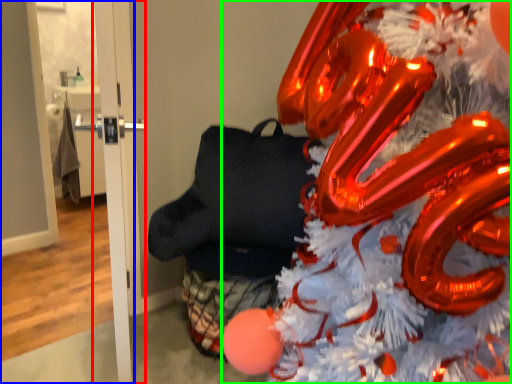
Question: Based on their relative distances, which object is farther from door (highlighted by a red box)? Choose from door (highlighted by a blue box) and christmas tree (highlighted by a green box).

Choices:
 (A) door
 (B) christmas tree

Answer: (A)